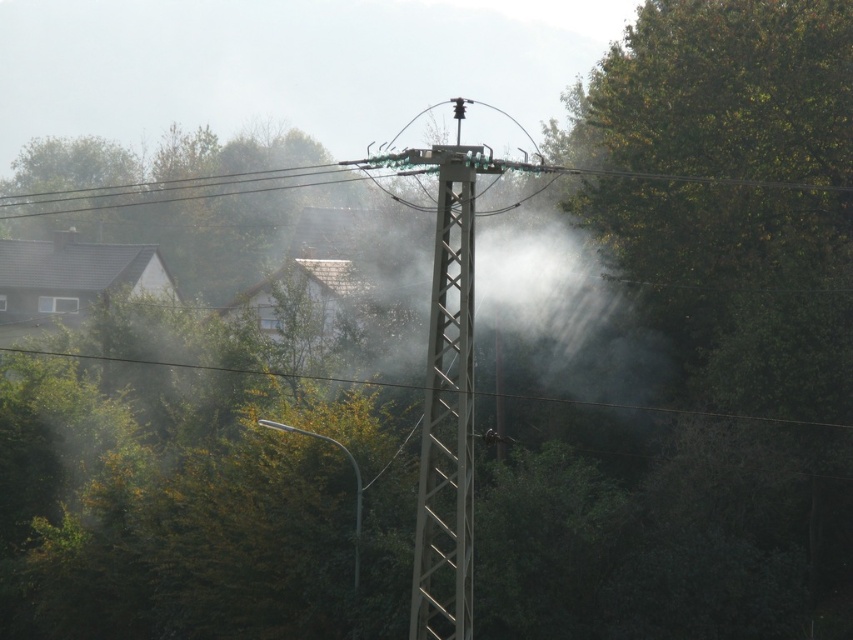
Does metallic gray telegraph pole at center appear on the left side of green leafy tree at upper left?

Incorrect, metallic gray telegraph pole at center is not on the left side of green leafy tree at upper left.

Between metallic gray telegraph pole at center and green leafy tree at upper left, which one appears on the left side from the viewer's perspective?

From the viewer's perspective, green leafy tree at upper left appears more on the left side.

Between point (450, 596) and point (51, 179), which one is positioned in front?

Point (450, 596) is in front.

Image resolution: width=853 pixels, height=640 pixels. Find the location of `metallic gray telegraph pole at center`. metallic gray telegraph pole at center is located at coordinates (447, 406).